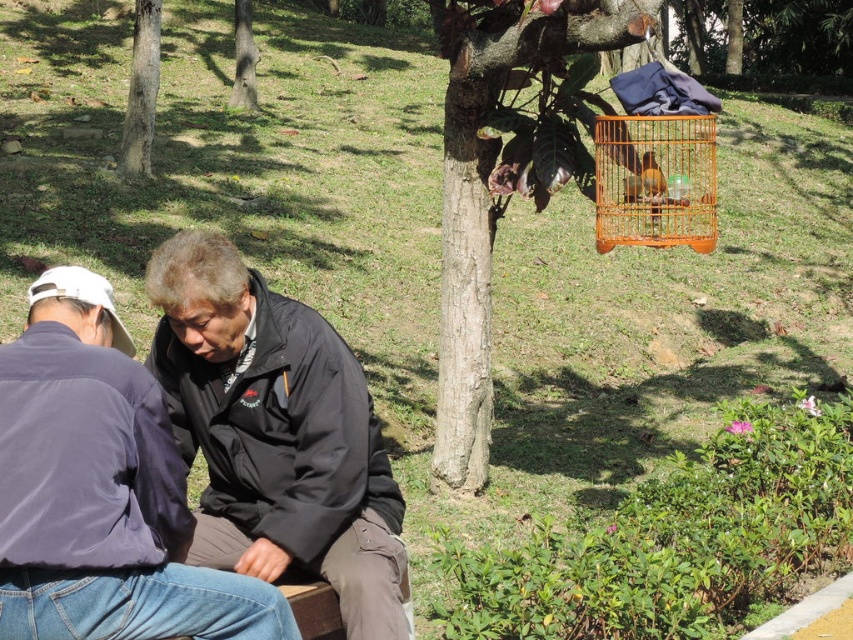
Based on the scene description, where is the brown wood tree at upper center located in terms of its 2D coordinates?

The brown wood tree at upper center is located at the 2D coordinates of point (490,189).

You are standing in the park and see the dark blue jacket at lower left and the brown rough tree trunk at upper center. Which object is positioned more to the east if the sun is shining from the west?

The brown rough tree trunk at upper center is positioned more to the east because shadows cast by the west sunlight would fall towards the east, and since the dark blue jacket at lower left is to the right of the brown rough tree trunk at upper center, it would be further west, making the tree trunk more eastward.